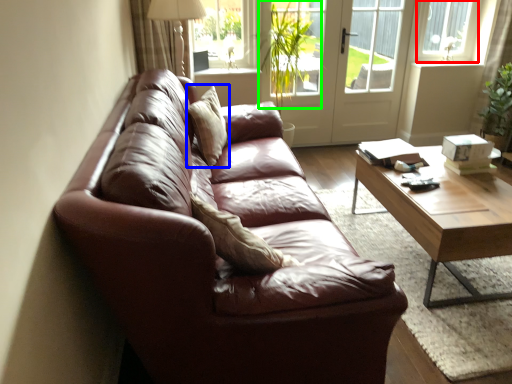
Question: Which is nearer to the window frame (highlighted by a red box)? pillow (highlighted by a blue box) or plant (highlighted by a green box).

Choices:
 (A) pillow
 (B) plant

Answer: (B)